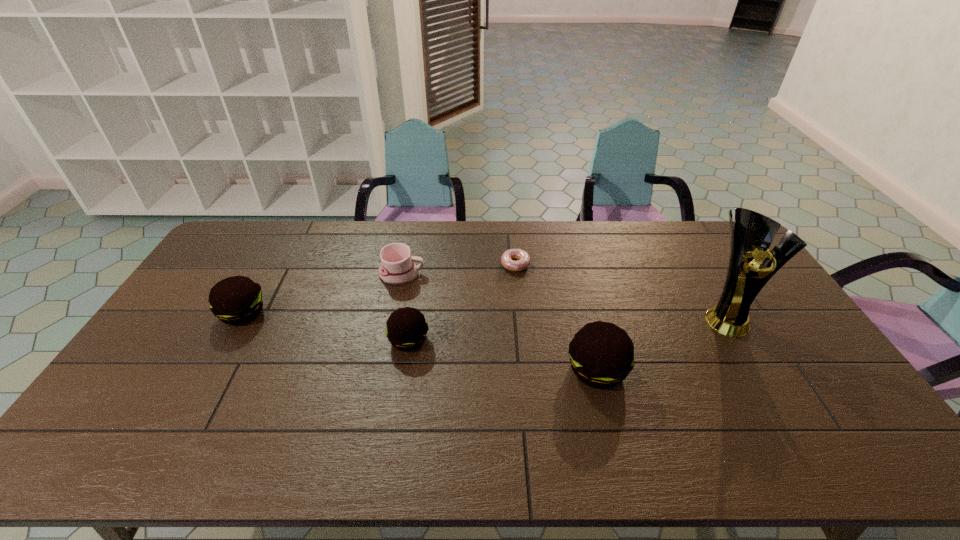
At what (x,y) coordinates should I click in order to perform the action: click on object that is the third closest to the second patty from right to left. Please return your answer as a coordinate pair (x, y). Image resolution: width=960 pixels, height=540 pixels. Looking at the image, I should click on (601, 354).

Locate an element on the screen. The width and height of the screenshot is (960, 540). object that stands as the fifth closest to the leftmost object is located at coordinates (751, 235).

At what (x,y) coordinates should I click in order to perform the action: click on patty that is the third closest one to the award. Please return your answer as a coordinate pair (x, y). This screenshot has width=960, height=540. Looking at the image, I should click on (236, 300).

Identify which patty is the second nearest to the leftmost object. Please provide its 2D coordinates. Your answer should be formatted as a tuple, i.e. [(x, y)], where the tuple contains the x and y coordinates of a point satisfying the conditions above.

[(601, 354)]

This screenshot has height=540, width=960. What are the coordinates of `vacant position in the image that satisfies the following two spatial constraints: 1. on the front side of the second patty from left to right; 2. on the right side of the second tallest patty` in the screenshot? It's located at (228, 340).